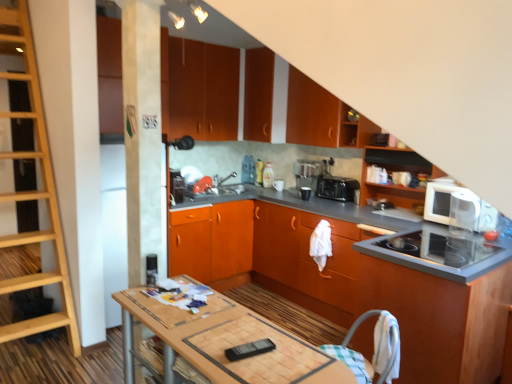
Question: Considering the positions of white glossy microwave at upper right and wooden ladder at left in the image, is white glossy microwave at upper right taller or shorter than wooden ladder at left?

Choices:
 (A) tall
 (B) short

Answer: (B)

Question: In terms of width, does white glossy microwave at upper right look wider or thinner when compared to wooden ladder at left?

Choices:
 (A) thin
 (B) wide

Answer: (A)

Question: Based on their relative distances, which object is farther from the orange matte cabinet at center, which ranks as the second cabinetry in bottom-to-top order?

Choices:
 (A) matte orange cabinet at upper center, which appears as the fifth cabinetry when ordered from the bottom
 (B) white glossy microwave at upper right
 (C) wooden ladder at left
 (D) orange matte cabinet at upper center, the 6th cabinetry from the bottom
 (E) orange matte cabinet at upper right, acting as the 5th cabinetry starting from the top

Answer: (C)

Question: Based on their relative distances, which object is nearer to the wooden table at center?

Choices:
 (A) orange matte cabinet at upper center, the second cabinetry in the top-to-bottom sequence
 (B) black plastic toaster at center
 (C) checkered fabric folding chair at lower right
 (D) orange matte cabinet at upper right, acting as the 5th cabinetry starting from the top
 (E) wooden ladder at left

Answer: (C)